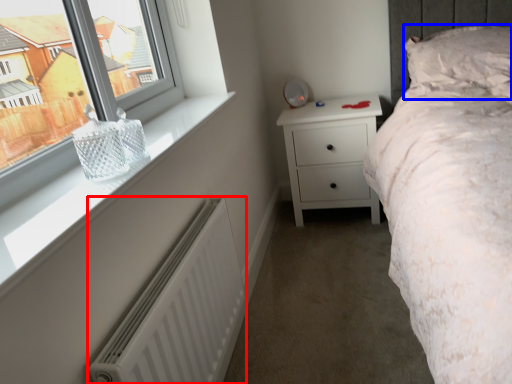
Question: Which point is closer to the camera, radiator (highlighted by a red box) or pillow (highlighted by a blue box)?

Choices:
 (A) radiator
 (B) pillow

Answer: (A)